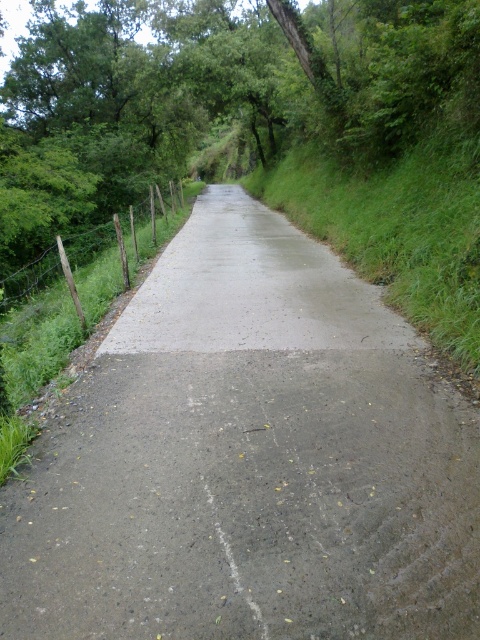
Which is more to the left, gray concrete road at center or green wire fence at left?

Positioned to the left is green wire fence at left.

How distant is gray concrete road at center from green wire fence at left?

gray concrete road at center and green wire fence at left are 3.91 meters apart.

Locate an element on the screen. The image size is (480, 640). gray concrete road at center is located at coordinates (249, 460).